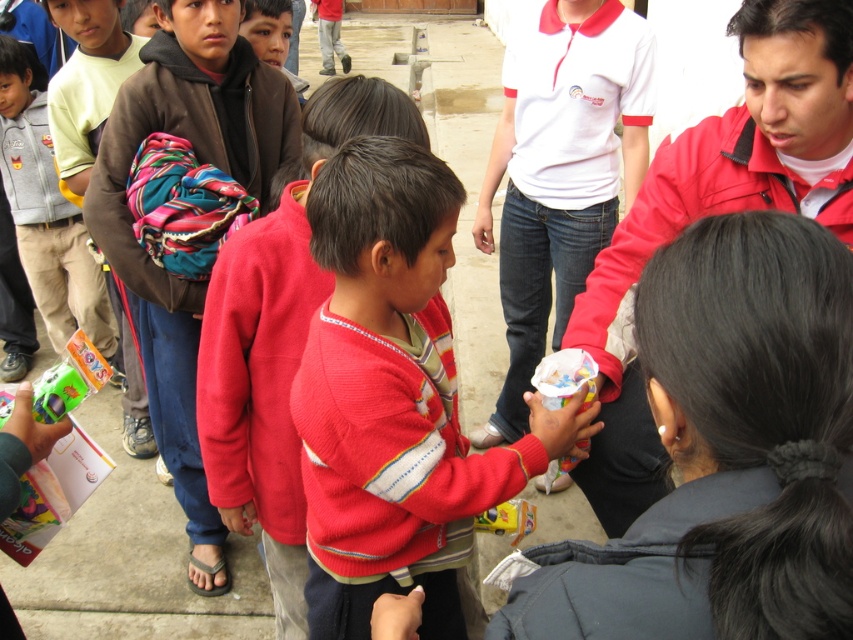
You are a photographer trying to capture a group photo of the children. You notice the brown fleece jacket at upper left and the light brown cotton pants at left. Which clothing item should you focus on to ensure it fits within the frame since it takes up more space?

The brown fleece jacket at upper left is bigger than the light brown cotton pants at left, so you should focus on the brown fleece jacket at upper left to ensure it fits within the frame since it takes up more space.

You are standing in a group of children wearing knitted red sweaters. You want to hand a gift to the child wearing the knitted red sweater at center without moving closer. Can you reach them from your current position?

The knitted red sweater at center is 4.51 feet away from viewer, so yes, you can reach them from your current position as the distance is manageable for handing over a gift without needing to move closer.